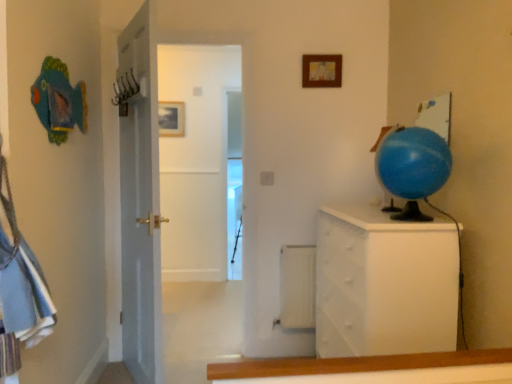
Measure the distance between point (386, 177) and camera.

The depth of point (386, 177) is 1.77 meters.

You are a GUI agent. You are given a task and a screenshot of the screen. Output one action in this format:
    pyautogui.click(x=<x>, y=<y>)
    Task: Click on the blue rubber globe at right
    
    Given the screenshot: What is the action you would take?
    pyautogui.click(x=413, y=162)

Considering the relative sizes of blue rubber globe at right and wooden picture frame at upper center, placed as the 1th picture frame when sorted from front to back, in the image provided, is blue rubber globe at right thinner than wooden picture frame at upper center, placed as the 1th picture frame when sorted from front to back,?

In fact, blue rubber globe at right might be wider than wooden picture frame at upper center, placed as the 1th picture frame when sorted from front to back.

Is blue rubber globe at right to the left or to the right of wooden picture frame at upper center, placed as the 1th picture frame when sorted from front to back, in the image?

blue rubber globe at right is positioned on wooden picture frame at upper center, placed as the 1th picture frame when sorted from front to back,'s right side.

Which picture frame is the 1st one when counting from the left side of the blue rubber globe at right? Please provide its 2D coordinates.

[(321, 71)]

Which object is more forward, blue rubber globe at right or wooden picture frame at upper center, the 1th picture frame positioned from the right?

blue rubber globe at right is closer to the camera.

Is blue rubber globe at right completely or partially inside matte gold picture frame at upper center, which is the 2th picture frame in right-to-left order?

No, matte gold picture frame at upper center, which is the 2th picture frame in right-to-left order, does not contain blue rubber globe at right.

Which is closer to the camera, (159, 105) or (445, 175)?

The point (445, 175) is closer.

Considering the sizes of objects matte gold picture frame at upper center, acting as the first picture frame starting from the left, and blue rubber globe at right in the image provided, who is shorter, matte gold picture frame at upper center, acting as the first picture frame starting from the left, or blue rubber globe at right?

matte gold picture frame at upper center, acting as the first picture frame starting from the left.

Between matte gold picture frame at upper center, acting as the first picture frame starting from the left, and blue rubber globe at right, which one has smaller width?

With smaller width is matte gold picture frame at upper center, acting as the first picture frame starting from the left.

Is blue rubber globe at right situated inside white textured chest of drawers at right or outside?

blue rubber globe at right lies outside white textured chest of drawers at right.

Does blue rubber globe at right have a greater height compared to white textured chest of drawers at right?

No, blue rubber globe at right is not taller than white textured chest of drawers at right.

From a real-world perspective, between blue rubber globe at right and white textured chest of drawers at right, who is vertically lower?

white textured chest of drawers at right.

From a real-world perspective, is white textured chest of drawers at right positioned above or below blue rubber globe at right?

white textured chest of drawers at right is situated lower than blue rubber globe at right in the real world.

Is blue rubber globe at right at the back of white textured chest of drawers at right?

white textured chest of drawers at right is not turned away from blue rubber globe at right.

At what (x,y) coordinates should I click in order to perform the action: click on the chest of drawers that is under the blue rubber globe at right (from a real-world perspective). Please return your answer as a coordinate pair (x, y). This screenshot has height=384, width=512. Looking at the image, I should click on (384, 284).

Would you say white textured chest of drawers at right is a long distance from blue rubber globe at right?

They are positioned close to each other.

Can you confirm if matte gold picture frame at upper center, acting as the first picture frame starting from the left, is taller than wooden picture frame at upper center, the 1th picture frame positioned from the right?

Yes, matte gold picture frame at upper center, acting as the first picture frame starting from the left, is taller than wooden picture frame at upper center, the 1th picture frame positioned from the right.

Is point (167, 125) farther from camera compared to point (334, 56)?

Yes, point (167, 125) is farther from viewer.

Which is more to the left, matte gold picture frame at upper center, acting as the first picture frame starting from the left, or wooden picture frame at upper center, the 1th picture frame positioned from the right?

matte gold picture frame at upper center, acting as the first picture frame starting from the left.

Between matte gold picture frame at upper center, acting as the first picture frame starting from the left, and wooden picture frame at upper center, the second picture frame viewed from the back, which one has larger width?

wooden picture frame at upper center, the second picture frame viewed from the back.

Based on their positions, is wooden picture frame at upper center, the 1th picture frame positioned from the right, located to the left or right of blue rubber globe at right?

From the image, it's evident that wooden picture frame at upper center, the 1th picture frame positioned from the right, is to the left of blue rubber globe at right.

Which of these two, wooden picture frame at upper center, placed as the second picture frame when sorted from left to right, or blue rubber globe at right, is smaller?

With smaller size is wooden picture frame at upper center, placed as the second picture frame when sorted from left to right.

Considering the positions of points (329, 72) and (436, 168), is point (329, 72) farther from camera compared to point (436, 168)?

Yes, it is.

From a real-world perspective, who is located higher, wooden picture frame at upper center, placed as the 1th picture frame when sorted from front to back, or blue rubber globe at right?

In real-world perspective, wooden picture frame at upper center, placed as the 1th picture frame when sorted from front to back, is above.

Considering the positions of points (339, 82) and (447, 276), is point (339, 82) closer to camera compared to point (447, 276)?

No, (339, 82) is behind (447, 276).

Does wooden picture frame at upper center, placed as the 1th picture frame when sorted from front to back, have a lesser width compared to white textured chest of drawers at right?

Correct, the width of wooden picture frame at upper center, placed as the 1th picture frame when sorted from front to back, is less than that of white textured chest of drawers at right.

The image size is (512, 384). In the image, there is a wooden picture frame at upper center, the 1th picture frame positioned from the right. What are the coordinates of `balloon below it (from the image's perspective)` in the screenshot? It's located at (413, 162).

The height and width of the screenshot is (384, 512). Find the location of `picture frame that is the 1st object located above the blue rubber globe at right (from the image's perspective)`. picture frame that is the 1st object located above the blue rubber globe at right (from the image's perspective) is located at coordinates (170, 119).

From the image, which object appears to be farther from white textured chest of drawers at right, blue rubber globe at right or matte gold picture frame at upper center, marked as the 2th picture frame in a front-to-back arrangement?

Among the two, matte gold picture frame at upper center, marked as the 2th picture frame in a front-to-back arrangement, is located further to white textured chest of drawers at right.

Estimate the real-world distances between objects in this image. Which object is further from blue rubber globe at right, wooden picture frame at upper center, the second picture frame viewed from the back, or white textured chest of drawers at right?

Among the two, wooden picture frame at upper center, the second picture frame viewed from the back, is located further to blue rubber globe at right.

From the image, which object appears to be farther from blue rubber globe at right, white textured chest of drawers at right or matte gold picture frame at upper center, acting as the first picture frame starting from the left?

The object further to blue rubber globe at right is matte gold picture frame at upper center, acting as the first picture frame starting from the left.

Considering their positions, is white textured chest of drawers at right positioned closer to matte gold picture frame at upper center, acting as the first picture frame starting from the left, than wooden picture frame at upper center, placed as the 1th picture frame when sorted from front to back?

wooden picture frame at upper center, placed as the 1th picture frame when sorted from front to back.

From the picture: From the image, which object appears to be nearer to wooden picture frame at upper center, placed as the second picture frame when sorted from left to right, white textured chest of drawers at right or blue rubber globe at right?

blue rubber globe at right lies closer to wooden picture frame at upper center, placed as the second picture frame when sorted from left to right, than the other object.

Considering their positions, is blue rubber globe at right positioned closer to matte gold picture frame at upper center, acting as the first picture frame starting from the left, than wooden picture frame at upper center, the 1th picture frame positioned from the right?

The object closer to matte gold picture frame at upper center, acting as the first picture frame starting from the left, is wooden picture frame at upper center, the 1th picture frame positioned from the right.

Considering their positions, is wooden picture frame at upper center, the 1th picture frame positioned from the right, positioned closer to matte gold picture frame at upper center, marked as the 2th picture frame in a front-to-back arrangement, than white textured chest of drawers at right?

wooden picture frame at upper center, the 1th picture frame positioned from the right, is closer to matte gold picture frame at upper center, marked as the 2th picture frame in a front-to-back arrangement.

When comparing their distances from white textured chest of drawers at right, does wooden picture frame at upper center, the second picture frame viewed from the back, or matte gold picture frame at upper center, which is the 2th picture frame in right-to-left order, seem further?

matte gold picture frame at upper center, which is the 2th picture frame in right-to-left order.

This screenshot has height=384, width=512. I want to click on chest of drawers between blue rubber globe at right and matte gold picture frame at upper center, marked as the 2th picture frame in a front-to-back arrangement, along the z-axis, so click(x=384, y=284).

What are the coordinates of `picture frame between white textured chest of drawers at right and matte gold picture frame at upper center, acting as the first picture frame starting from the left, along the z-axis` in the screenshot? It's located at (321, 71).

Where is `picture frame positioned between blue rubber globe at right and matte gold picture frame at upper center, positioned as the first picture frame in back-to-front order, from near to far`? This screenshot has width=512, height=384. picture frame positioned between blue rubber globe at right and matte gold picture frame at upper center, positioned as the first picture frame in back-to-front order, from near to far is located at coordinates (321, 71).

At what (x,y) coordinates should I click in order to perform the action: click on balloon between wooden picture frame at upper center, placed as the second picture frame when sorted from left to right, and white textured chest of drawers at right vertically. Please return your answer as a coordinate pair (x, y). Looking at the image, I should click on (413, 162).